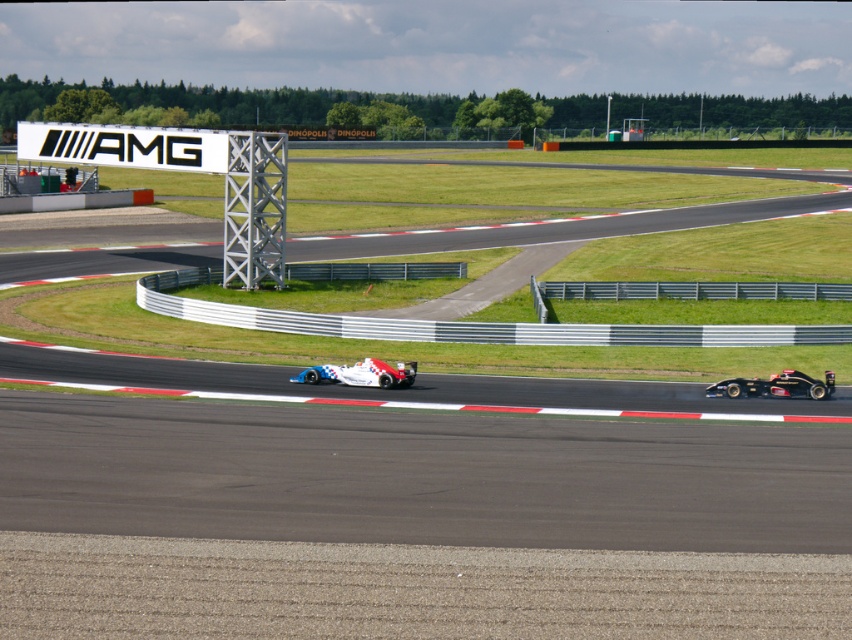
Question: Which point is closer to the camera?

Choices:
 (A) (706, 394)
 (B) (370, 369)

Answer: (A)

Question: Which object is closer to the camera taking this photo?

Choices:
 (A) white glossy race car at center
 (B) black carbon fiber race car at right

Answer: (B)

Question: Can you confirm if black carbon fiber race car at right is positioned to the right of white glossy race car at center?

Choices:
 (A) yes
 (B) no

Answer: (A)

Question: Can you confirm if black carbon fiber race car at right is positioned to the right of white glossy race car at center?

Choices:
 (A) yes
 (B) no

Answer: (A)

Question: Can you confirm if black carbon fiber race car at right is bigger than white glossy race car at center?

Choices:
 (A) yes
 (B) no

Answer: (B)